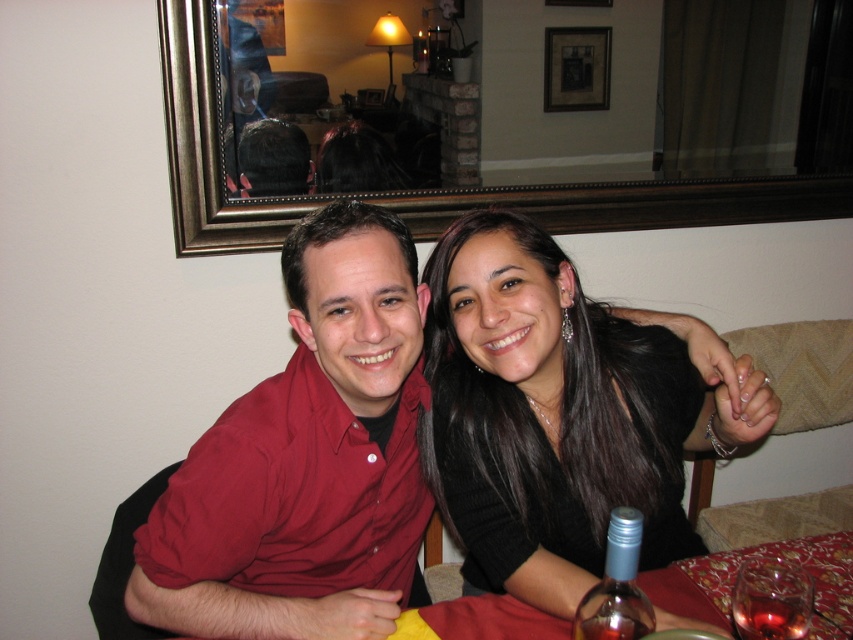
You are a photographer setting up for a portrait. You need to position a light source so it illuminates both the black matte hair at center and the translucent glass wine at lower right without casting harsh shadows. Considering their positions, where should you place the light source relative to the two objects?

The black matte hair at center is to the left of the translucent glass wine at lower right. To avoid harsh shadows, the light source should be placed to the right of both objects, ensuring even illumination across both subjects.

You are a photographer setting up a shoot in this dining area. You need to position a light source so that it illuminates both the matte red shirt at center and the wooden picture frame at upper center. Based on their positions, which object should be placed closer to the light source to ensure even lighting?

The matte red shirt at center should be placed closer to the light source because it is positioned on the left side of the wooden picture frame at upper center, meaning it is farther away from the light source if the frame is closer to the light. To balance the lighting, moving the shirt closer ensures both receive similar illumination.